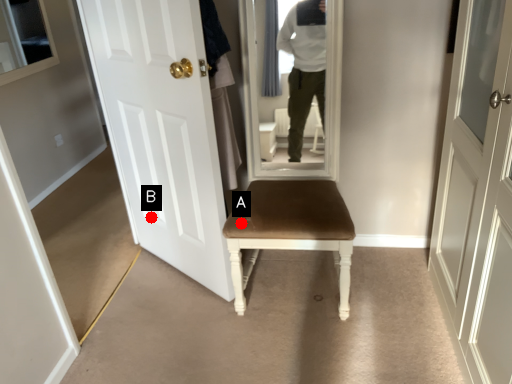
Question: Two points are circled on the image, labeled by A and B beside each circle. Which of the following is the farthest from the observer?

Choices:
 (A) A is further
 (B) B is further

Answer: (B)